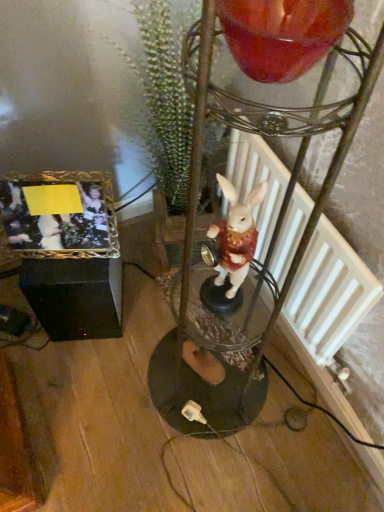
Question: Is gold metallic photo frame at lower left facing away from shiny glass candle at upper center?

Choices:
 (A) no
 (B) yes

Answer: (A)

Question: Is gold metallic photo frame at lower left far away from shiny glass candle at upper center?

Choices:
 (A) yes
 (B) no

Answer: (B)

Question: Is gold metallic photo frame at lower left positioned in front of shiny glass candle at upper center?

Choices:
 (A) no
 (B) yes

Answer: (A)

Question: Can you confirm if gold metallic photo frame at lower left is thinner than shiny glass candle at upper center?

Choices:
 (A) yes
 (B) no

Answer: (A)

Question: Is gold metallic photo frame at lower left smaller than shiny glass candle at upper center?

Choices:
 (A) yes
 (B) no

Answer: (B)

Question: From a real-world perspective, is gold metallic photo frame at lower left below shiny glass candle at upper center?

Choices:
 (A) no
 (B) yes

Answer: (B)

Question: Is gold metallic photo frame at lower left bigger than green textured plant at center?

Choices:
 (A) no
 (B) yes

Answer: (A)

Question: Would you say gold metallic photo frame at lower left contains green textured plant at center?

Choices:
 (A) no
 (B) yes

Answer: (A)

Question: Is gold metallic photo frame at lower left smaller than green textured plant at center?

Choices:
 (A) yes
 (B) no

Answer: (A)

Question: Considering the relative sizes of gold metallic photo frame at lower left and green textured plant at center in the image provided, is gold metallic photo frame at lower left wider than green textured plant at center?

Choices:
 (A) no
 (B) yes

Answer: (A)

Question: Considering the relative sizes of gold metallic photo frame at lower left and green textured plant at center in the image provided, is gold metallic photo frame at lower left taller than green textured plant at center?

Choices:
 (A) yes
 (B) no

Answer: (B)

Question: Considering the relative positions of gold metallic photo frame at lower left and green textured plant at center in the image provided, is gold metallic photo frame at lower left to the right of green textured plant at center from the viewer's perspective?

Choices:
 (A) no
 (B) yes

Answer: (A)

Question: Is gold metallic photo frame at lower left positioned beyond the bounds of white matte radiator at center-right?

Choices:
 (A) yes
 (B) no

Answer: (A)